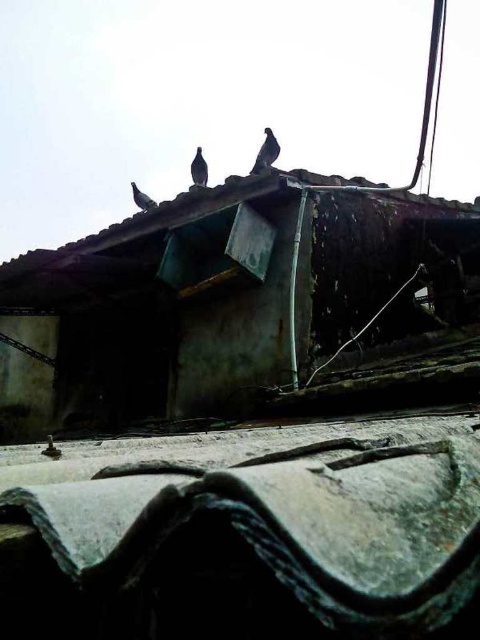
Which of these two, rusty metal hut at upper center or dark gray feathered bird at upper center, stands taller?

With more height is dark gray feathered bird at upper center.

Which is more to the right, rusty metal hut at upper center or dark gray feathered bird at upper center?

rusty metal hut at upper center

This screenshot has width=480, height=640. I want to click on rusty metal hut at upper center, so click(167, 307).

Does gray textured tile roof at lower center appear on the right side of rusty metal hut at upper center?

Yes, gray textured tile roof at lower center is to the right of rusty metal hut at upper center.

Is gray textured tile roof at lower center below rusty metal hut at upper center?

Yes, gray textured tile roof at lower center is below rusty metal hut at upper center.

In the scene shown: Measure the distance between gray textured tile roof at lower center and camera.

28.07 centimeters

The height and width of the screenshot is (640, 480). In order to click on gray textured tile roof at lower center in this screenshot , I will do `click(252, 541)`.

Which is more to the left, gray matte pigeon at upper center or silvery metallic bird at upper center?

Positioned to the left is silvery metallic bird at upper center.

Measure the distance between point (251, 173) and camera.

Point (251, 173) is 11.26 feet away from camera.

You are a GUI agent. You are given a task and a screenshot of the screen. Output one action in this format:
    pyautogui.click(x=<x>, y=<y>)
    Task: Click on the gray matte pigeon at upper center
    The width and height of the screenshot is (480, 640).
    Given the screenshot: What is the action you would take?
    pyautogui.click(x=265, y=152)